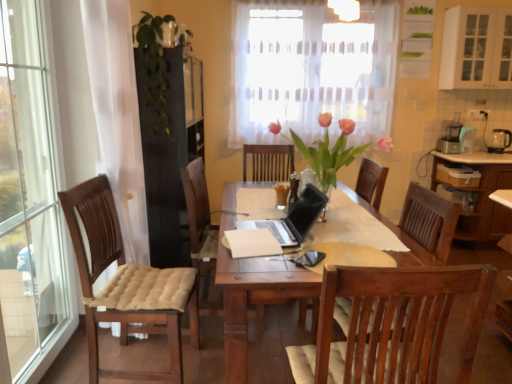
Find the location of `free space above translucent fabric curtain at upper center (from a real-world perspective)`. free space above translucent fabric curtain at upper center (from a real-world perspective) is located at coordinates (357, 5).